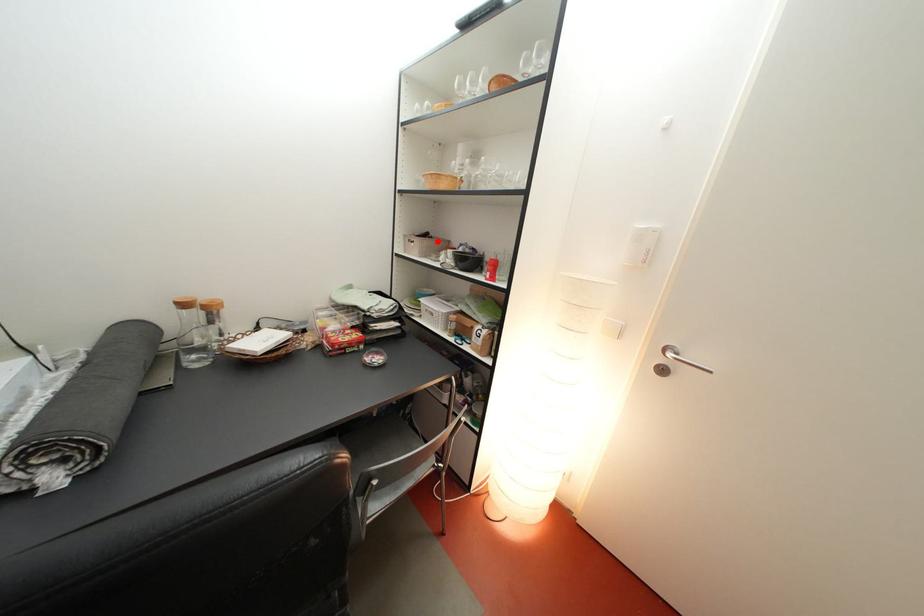
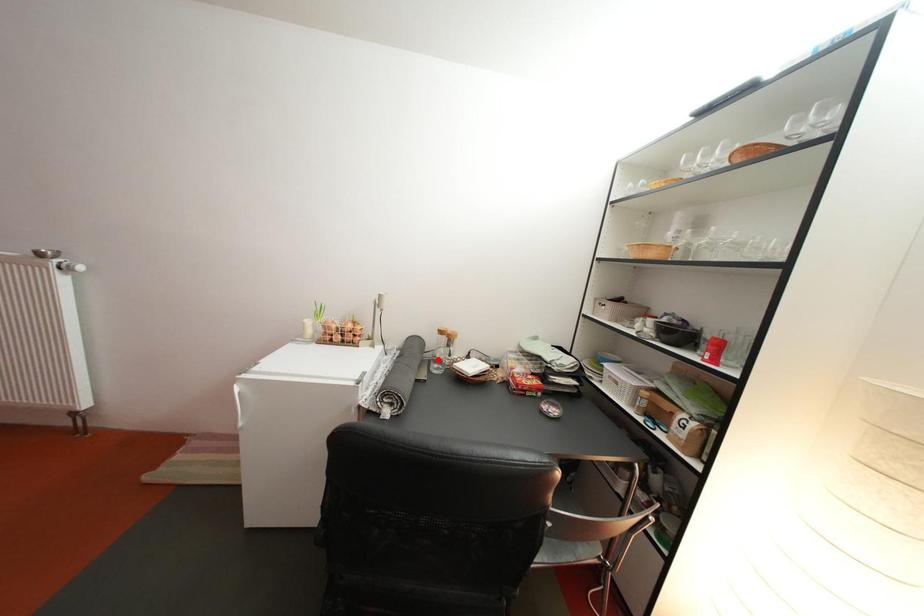
I am providing you with two images of the same scene from different viewpoints. A red point is marked on the first image and another point is marked on the second image. Are the points marked in image1 and image2 representing the same 3D position?

No